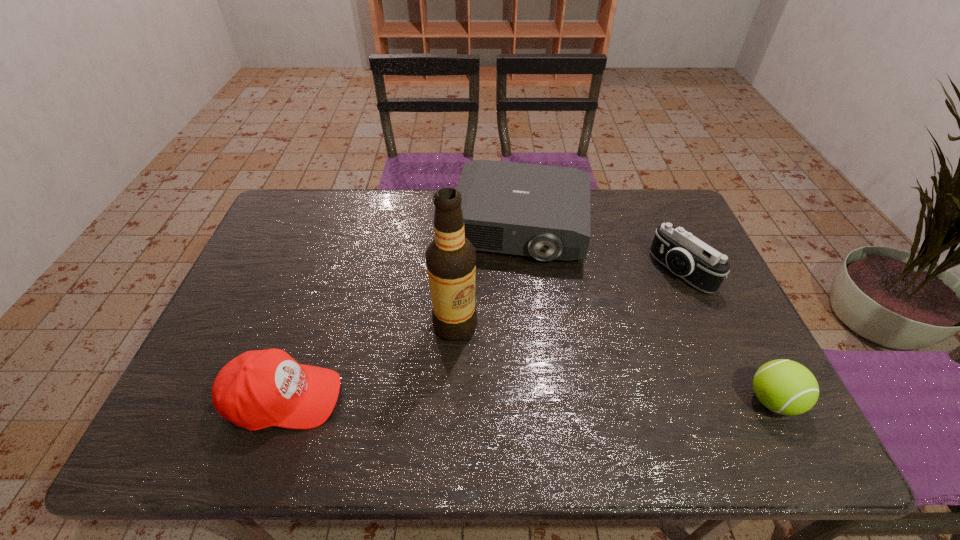
Locate an element on the screen. vacant position located on the front-facing side of the projector is located at coordinates (506, 291).

Where is `free space located on the front lens of the camera`? free space located on the front lens of the camera is located at coordinates (627, 310).

Locate an element on the screen. This screenshot has height=540, width=960. vacant area situated on the front lens of the camera is located at coordinates (641, 300).

Where is `vacant point located on the front lens of the camera`? This screenshot has height=540, width=960. vacant point located on the front lens of the camera is located at coordinates (613, 318).

I want to click on free space located on the label of the alcohol, so click(468, 380).

Locate an element on the screen. Image resolution: width=960 pixels, height=540 pixels. object that is at the far edge is located at coordinates (542, 211).

At what (x,y) coordinates should I click in order to perform the action: click on baseball cap located at the near edge. Please return your answer as a coordinate pair (x, y). Looking at the image, I should click on (258, 389).

You are a GUI agent. You are given a task and a screenshot of the screen. Output one action in this format:
    pyautogui.click(x=<x>, y=<y>)
    Task: Click on the tennis ball that is at the near edge
    
    Given the screenshot: What is the action you would take?
    pyautogui.click(x=786, y=387)

You are a GUI agent. You are given a task and a screenshot of the screen. Output one action in this format:
    pyautogui.click(x=<x>, y=<y>)
    Task: Click on the object present at the left edge
    
    Given the screenshot: What is the action you would take?
    pyautogui.click(x=258, y=389)

You are a GUI agent. You are given a task and a screenshot of the screen. Output one action in this format:
    pyautogui.click(x=<x>, y=<y>)
    Task: Click on the tennis ball at the right edge
    This screenshot has height=540, width=960.
    Given the screenshot: What is the action you would take?
    pyautogui.click(x=786, y=387)